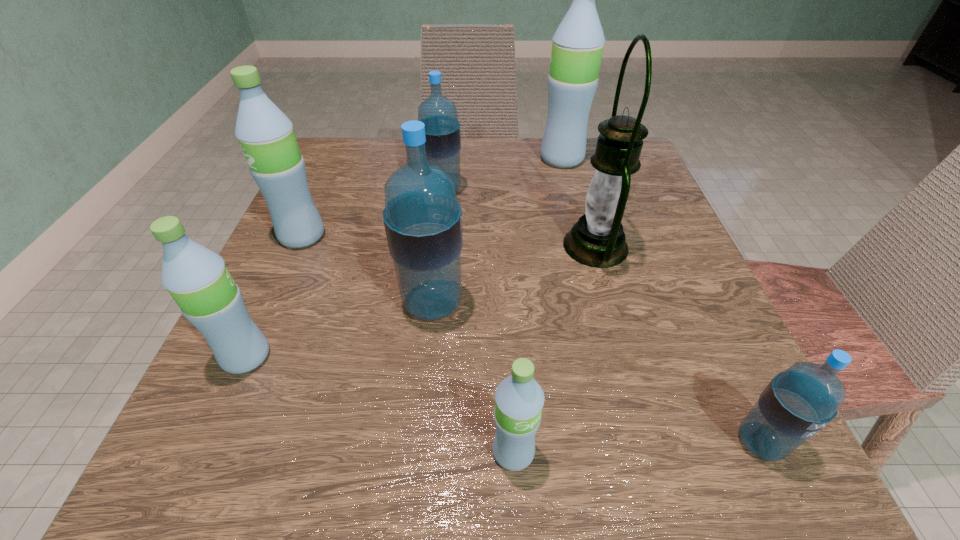
Where is `blank space at the right edge of the desktop`? The height and width of the screenshot is (540, 960). blank space at the right edge of the desktop is located at coordinates (x=655, y=327).

I want to click on vacant space at the far left corner, so click(x=324, y=180).

In the image, there is a desktop. At what (x,y) coordinates should I click in order to perform the action: click on vacant space at the far right corner. Please return your answer as a coordinate pair (x, y). The image size is (960, 540). Looking at the image, I should click on (581, 174).

In the image, there is a desktop. Where is `free space at the near right corner`? This screenshot has height=540, width=960. free space at the near right corner is located at coordinates (727, 476).

Find the location of a particular element. free spot between the second smallest blue water bottle and the third nearest green water bottle is located at coordinates (372, 213).

In order to click on free space between the sixth water bottle from left to right and the green lantern in this screenshot , I will do `click(579, 202)`.

You are a GUI agent. You are given a task and a screenshot of the screen. Output one action in this format:
    pyautogui.click(x=<x>, y=<y>)
    Task: Click on the vacant space that's between the farthest water bottle and the lantern
    This screenshot has width=960, height=540.
    Given the screenshot: What is the action you would take?
    pyautogui.click(x=579, y=202)

This screenshot has height=540, width=960. In order to click on vacant area that lies between the biggest blue water bottle and the fourth object from right to left in this screenshot , I will do (x=473, y=378).

Identify the location of free space that is in between the tallest water bottle and the biggest blue water bottle. (497, 231).

Image resolution: width=960 pixels, height=540 pixels. I want to click on unoccupied position between the second farthest green water bottle and the biggest blue water bottle, so click(368, 270).